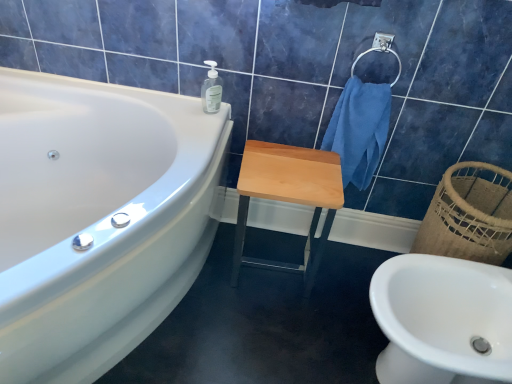
Question: Considering their positions, is satin silver towel bar at upper right located in front of or behind white glossy bathtub at upper left?

Choices:
 (A) behind
 (B) front

Answer: (A)

Question: Considering the positions of point (385, 38) and point (130, 188), is point (385, 38) closer or farther from the camera than point (130, 188)?

Choices:
 (A) farther
 (B) closer

Answer: (B)

Question: Which is nearer to the satin silver towel bar at upper right?

Choices:
 (A) light wood/matte stool at center
 (B) white glossy sink at lower right
 (C) blue cotton towel at upper right
 (D) transparent plastic soap dispenser at upper center
 (E) white glossy bathtub at upper left

Answer: (C)

Question: Estimate the real-world distances between objects in this image. Which object is closer to the blue cotton towel at upper right?

Choices:
 (A) white glossy bathtub at upper left
 (B) transparent plastic soap dispenser at upper center
 (C) white glossy sink at lower right
 (D) light wood/matte stool at center
 (E) satin silver towel bar at upper right

Answer: (D)